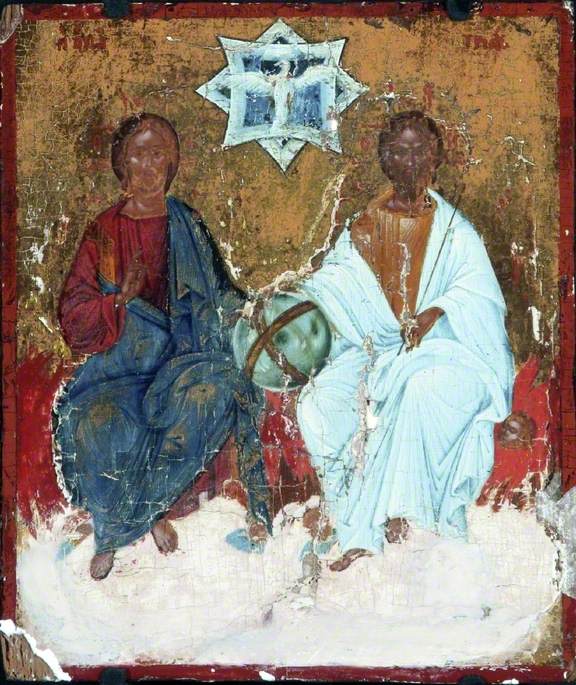
Image resolution: width=576 pixels, height=685 pixels. Find the location of `robes`. robes is located at coordinates (348, 297), (196, 284).